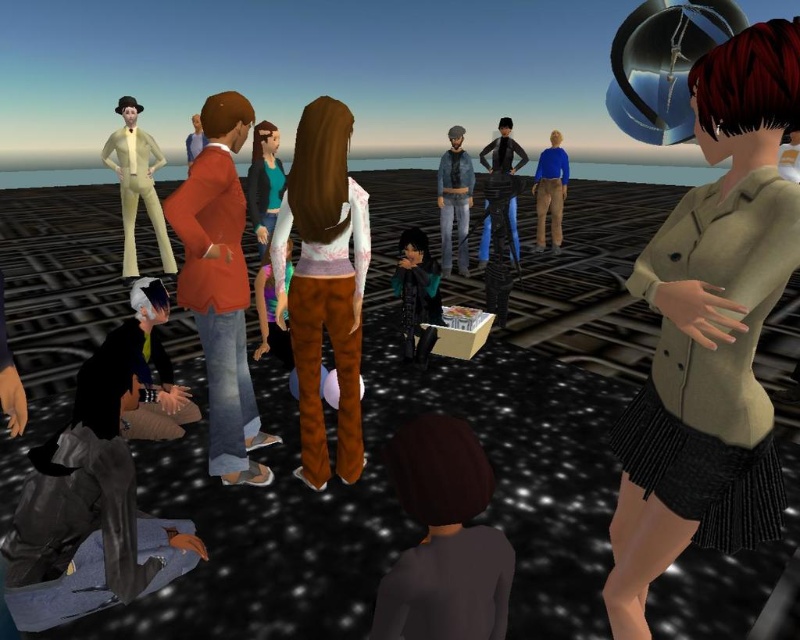
In the scene shown: Who is lower down, orange fabric jacket at center or light yellow fabric suit at upper left?

orange fabric jacket at center is lower down.

Which is behind, point (230, 460) or point (136, 140)?

Positioned behind is point (136, 140).

Image resolution: width=800 pixels, height=640 pixels. I want to click on orange fabric jacket at center, so click(220, 285).

Locate an element on the screen. Image resolution: width=800 pixels, height=640 pixels. orange fabric jacket at center is located at coordinates tap(220, 285).

Is point (230, 92) closer to viewer compared to point (200, 148)?

Yes, it is in front of point (200, 148).

Between point (232, 230) and point (196, 122), which one is positioned behind?

Positioned behind is point (196, 122).

Is point (224, 154) in front of point (200, 144)?

Yes, it is.

This screenshot has width=800, height=640. In order to click on orange fabric jacket at center in this screenshot , I will do `click(220, 285)`.

Does shiny black hair at lower left lie in front of light yellow fabric suit at upper left?

Yes, shiny black hair at lower left is in front of light yellow fabric suit at upper left.

Does shiny black hair at lower left have a larger size compared to light yellow fabric suit at upper left?

No, shiny black hair at lower left is not bigger than light yellow fabric suit at upper left.

Who is more distant from viewer, (148, 308) or (126, 264)?

Point (126, 264)

Where is `shiny black hair at lower left`? Image resolution: width=800 pixels, height=640 pixels. shiny black hair at lower left is located at coordinates (152, 368).